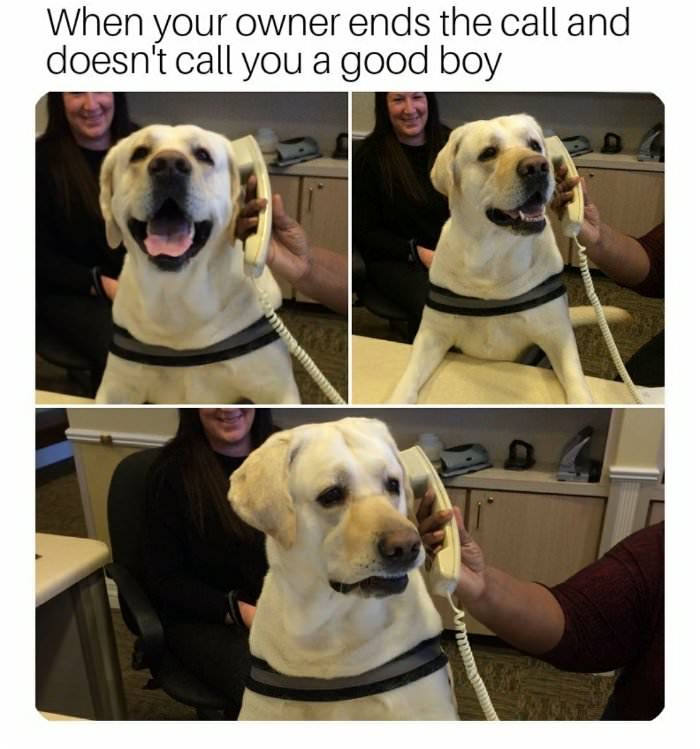
This screenshot has width=700, height=749. Find the location of `floor`. floor is located at coordinates (505, 679).